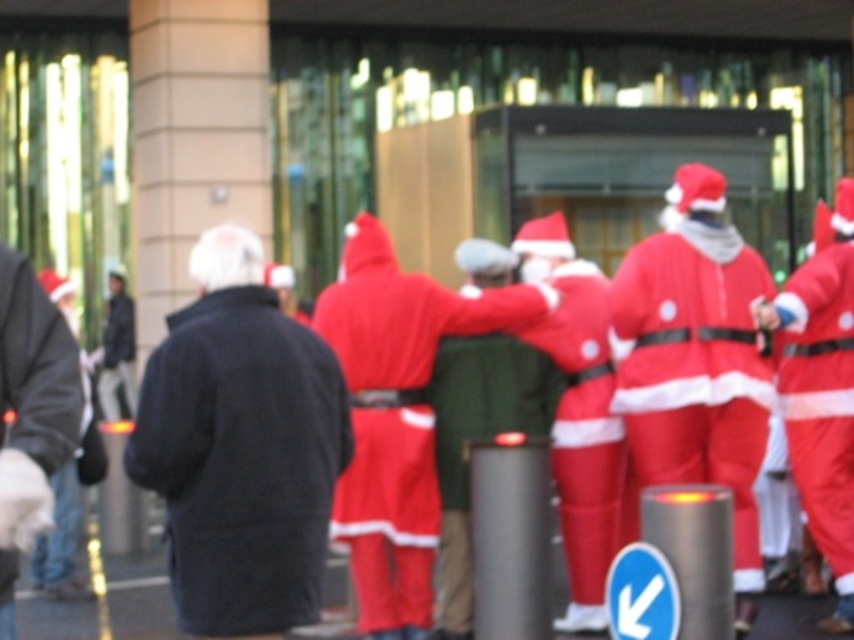
Question: Considering the real-world distances, which object is closest to the matte red santa at center?

Choices:
 (A) velvet red santa suit at center
 (B) matte red santa suit at center

Answer: (A)

Question: Among these objects, which one is farthest from the camera?

Choices:
 (A) matte red santa suit at center
 (B) dark wool coat at center

Answer: (A)

Question: Is matte red santa at center positioned before matte black coat at left?

Choices:
 (A) no
 (B) yes

Answer: (A)

Question: Can you confirm if matte red santa at right is positioned to the left of matte black coat at left?

Choices:
 (A) no
 (B) yes

Answer: (A)

Question: Does matte red santa suit at center have a greater width compared to matte red santa at right?

Choices:
 (A) no
 (B) yes

Answer: (B)

Question: Which of the following is the closest to the observer?

Choices:
 (A) (63, 448)
 (B) (351, 269)

Answer: (A)